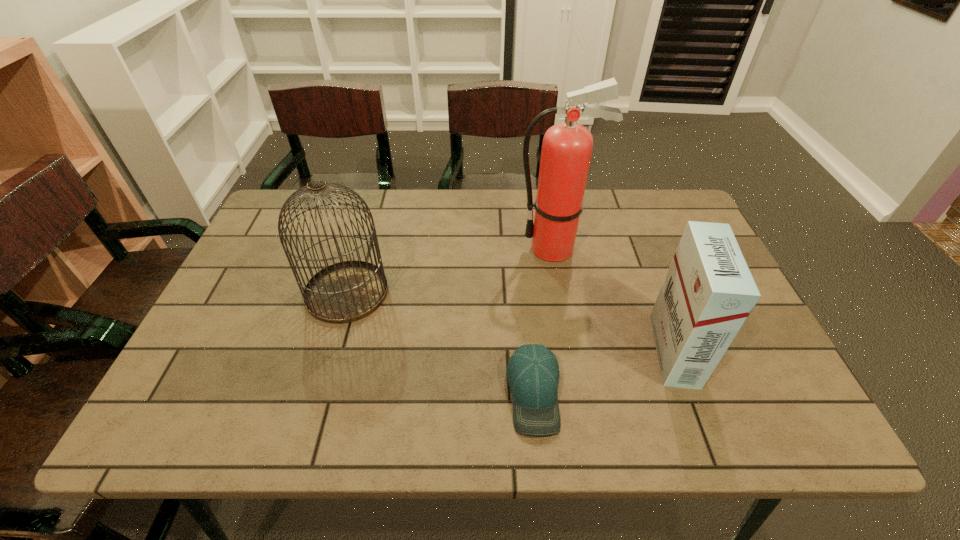
Locate an element on the screen. the closest object to the baseball cap is located at coordinates (708, 293).

At what (x,y) coordinates should I click in order to perform the action: click on vacant position in the image that satisfies the following two spatial constraints: 1. on the hose direction of the farthest object; 2. on the front side of the baseball cap. Please return your answer as a coordinate pair (x, y). Looking at the image, I should click on (580, 393).

Find the location of a particular element. This screenshot has height=540, width=960. vacant space that satisfies the following two spatial constraints: 1. on the hose direction of the fire extinguisher; 2. on the left side of the cigarette case is located at coordinates (572, 350).

Locate an element on the screen. The height and width of the screenshot is (540, 960). blank space that satisfies the following two spatial constraints: 1. on the hose direction of the rightmost object; 2. on the right side of the fire extinguisher is located at coordinates 572,350.

Locate an element on the screen. The width and height of the screenshot is (960, 540). free space that satisfies the following two spatial constraints: 1. on the front side of the birdcage; 2. on the left side of the cigarette case is located at coordinates (330, 350).

You are a GUI agent. You are given a task and a screenshot of the screen. Output one action in this format:
    pyautogui.click(x=<x>, y=<y>)
    Task: Click on the free space in the image that satisfies the following two spatial constraints: 1. on the back side of the cigarette case; 2. on the hose direction of the farthest object
    
    Given the screenshot: What is the action you would take?
    pyautogui.click(x=636, y=248)

Identify the location of free location that satisfies the following two spatial constraints: 1. on the hose direction of the rightmost object; 2. on the right side of the farthest object. (572, 350).

Find the location of a particular element. vacant space that satisfies the following two spatial constraints: 1. on the back side of the rightmost object; 2. on the hose direction of the fire extinguisher is located at coordinates (636, 248).

Identify the location of free space in the image that satisfies the following two spatial constraints: 1. on the back side of the shortest object; 2. on the right side of the cigarette case. (530, 350).

Where is `free space that satisfies the following two spatial constraints: 1. on the hose direction of the rightmost object; 2. on the left side of the fire extinguisher`? The image size is (960, 540). free space that satisfies the following two spatial constraints: 1. on the hose direction of the rightmost object; 2. on the left side of the fire extinguisher is located at coordinates (572, 350).